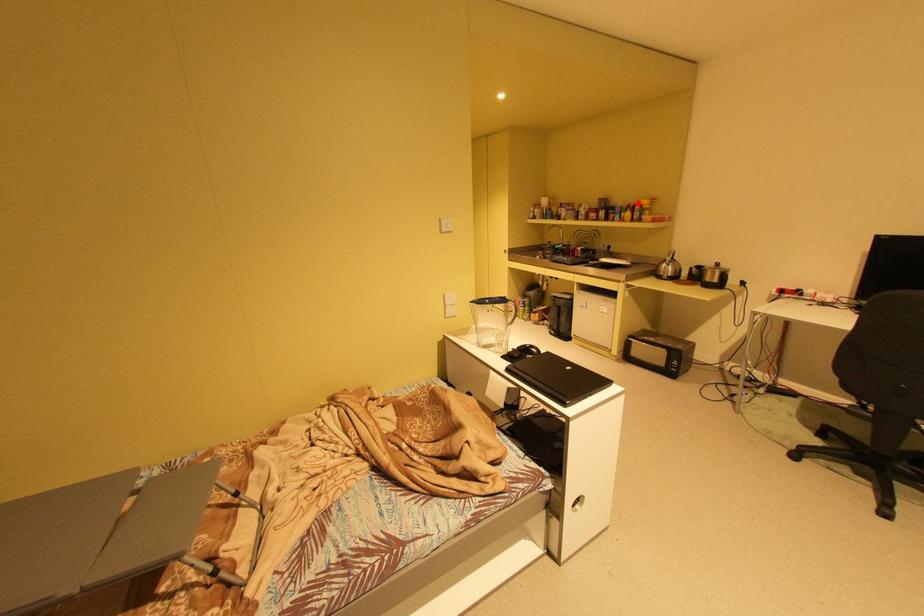
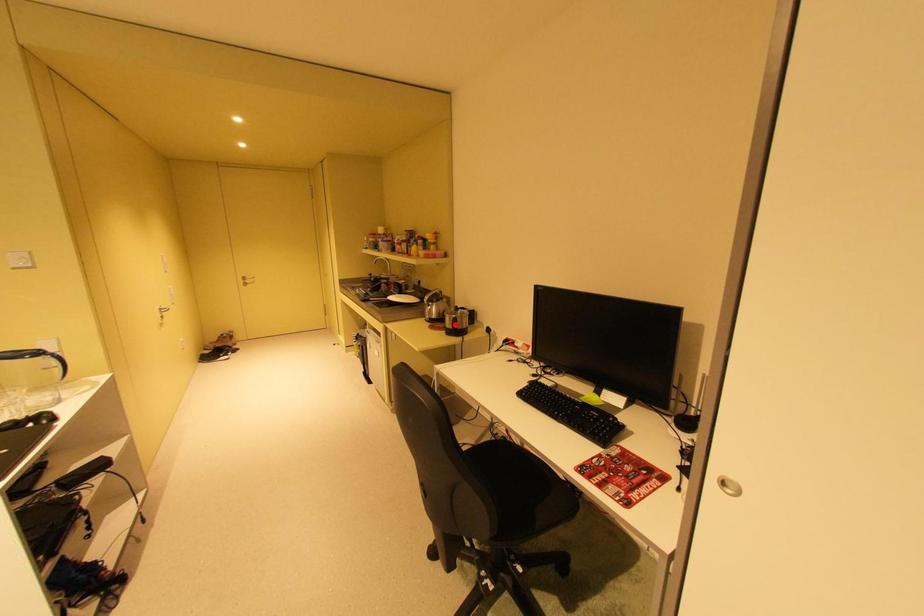
I am providing you with two images of the same scene from different viewpoints. A red point is marked on the first image and another point is marked on the second image. Is the red point in image1 aligned with the point shown in image2?

No